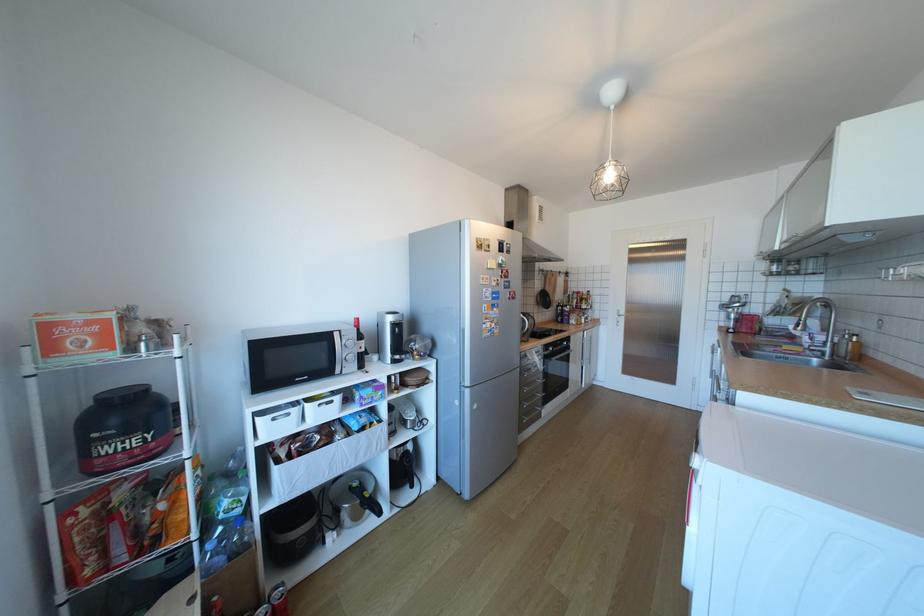
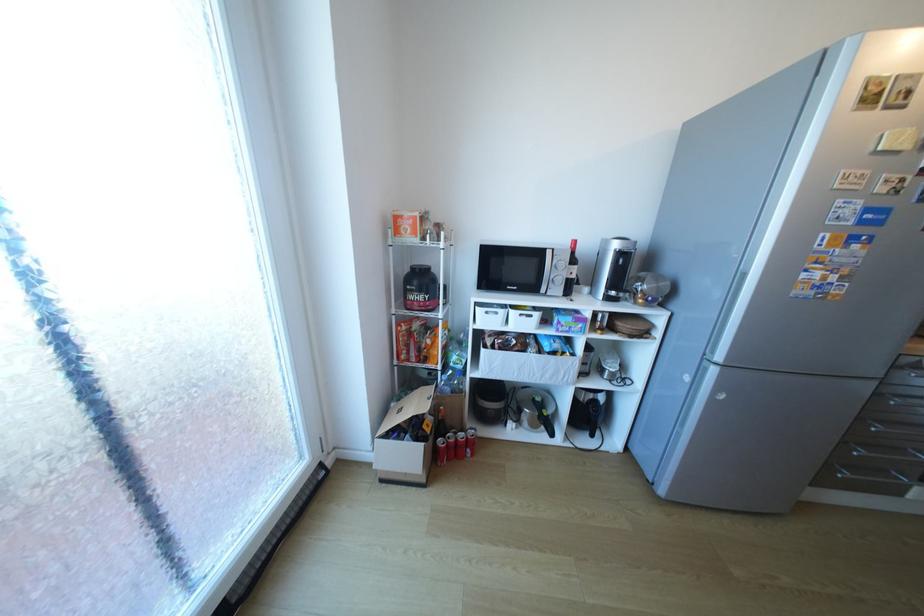
Locate, in the second image, the point that corresponds to the point at 263,546 in the first image.

(472, 394)